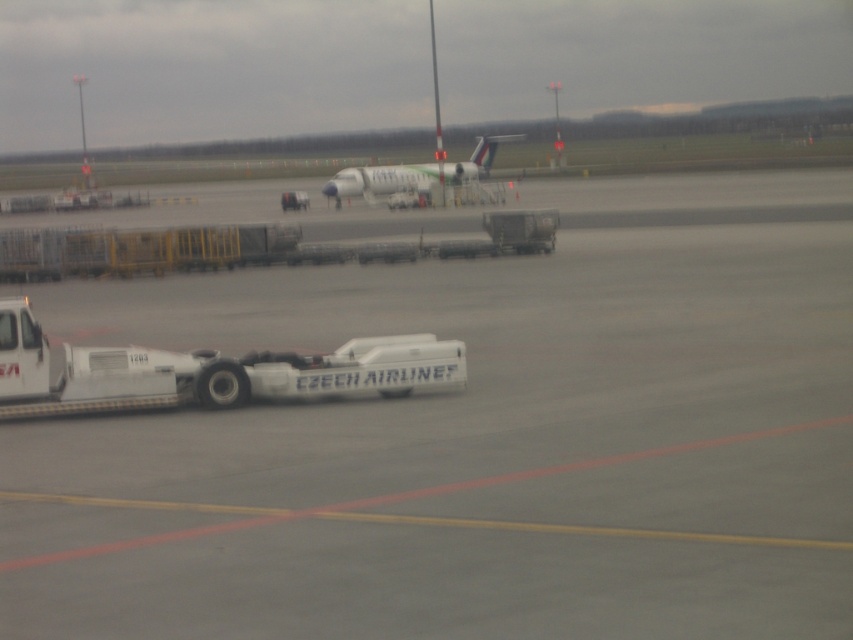
You are an airport staff member needing to move the white glossy airplane at center to another gate. The white matte tow truck at lower left is available. Can the tow truck reach the airplane from its current position without moving around any obstacles?

Yes, the white matte tow truck at lower left can reach the white glossy airplane at center because it is positioned to the left of the airplane, allowing direct access without needing to navigate around obstacles.

You are standing at the point labeled as point (479, 440) in the airport scene. What object is directly beneath your feet?

The object directly beneath your feet at point (479, 440) is the white rubber tarmac at center.

You are a maintenance worker at the airport. You need to inspect the area where the white rubber tarmac at center and the white glossy airplane at center are located. Which object is directly below the other?

The white rubber tarmac at center is positioned under the white glossy airplane at center, so the tarmac is directly below the airplane.